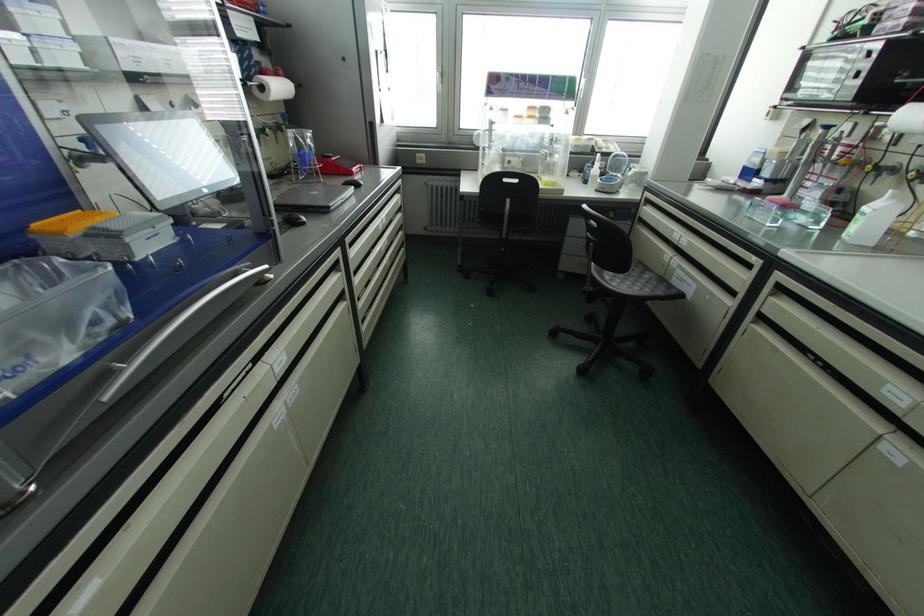
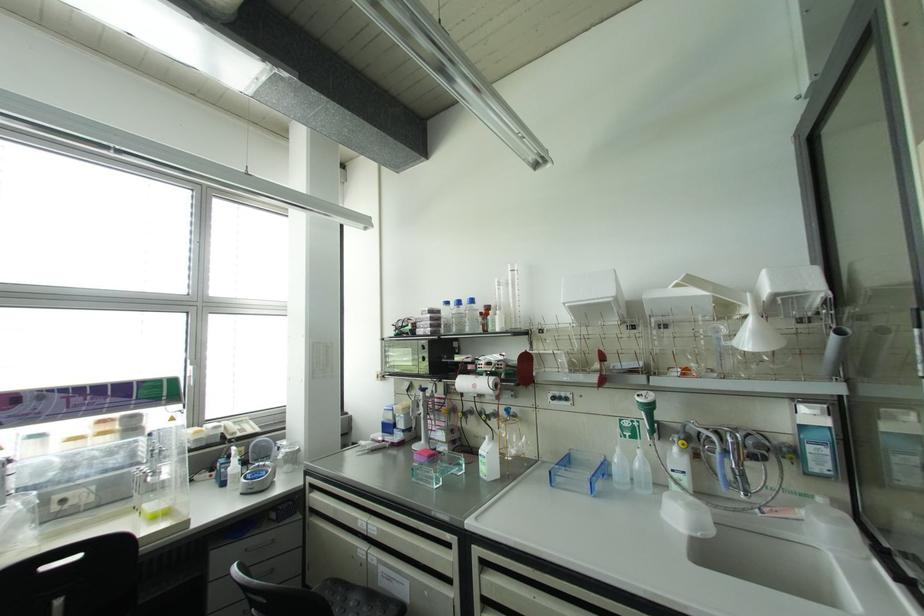
Find the pixel in the second image that matches [662,280] in the first image.

(371, 596)